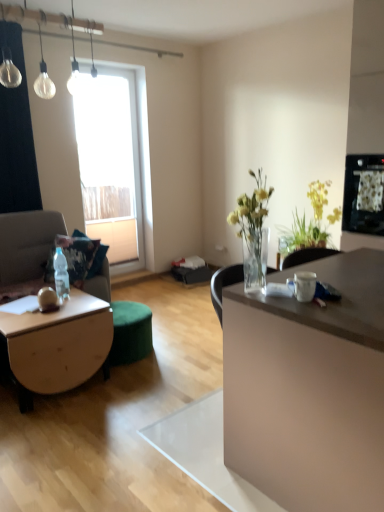
Locate an element on the screen. This screenshot has height=512, width=384. unoccupied region to the right of wooden coffee table at lower left is located at coordinates (136, 395).